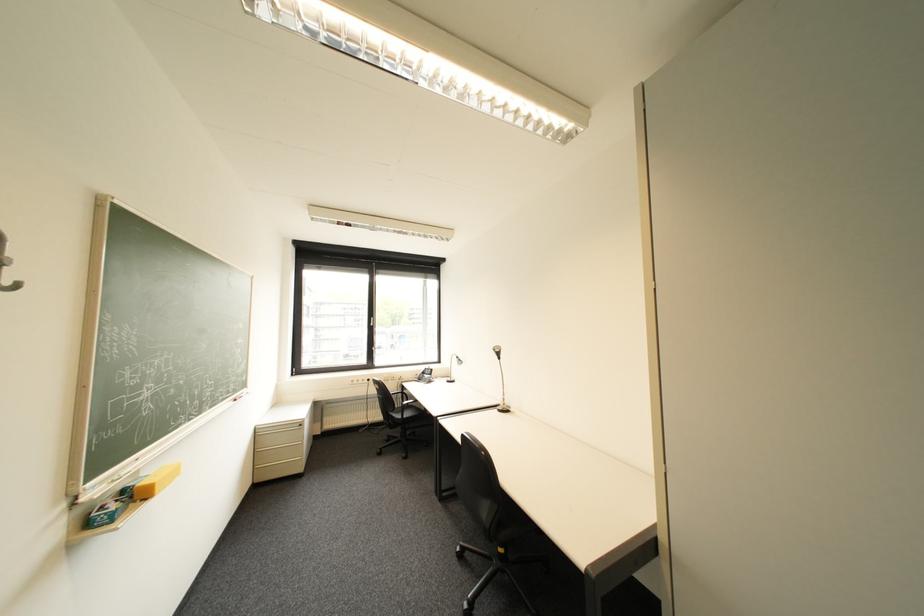
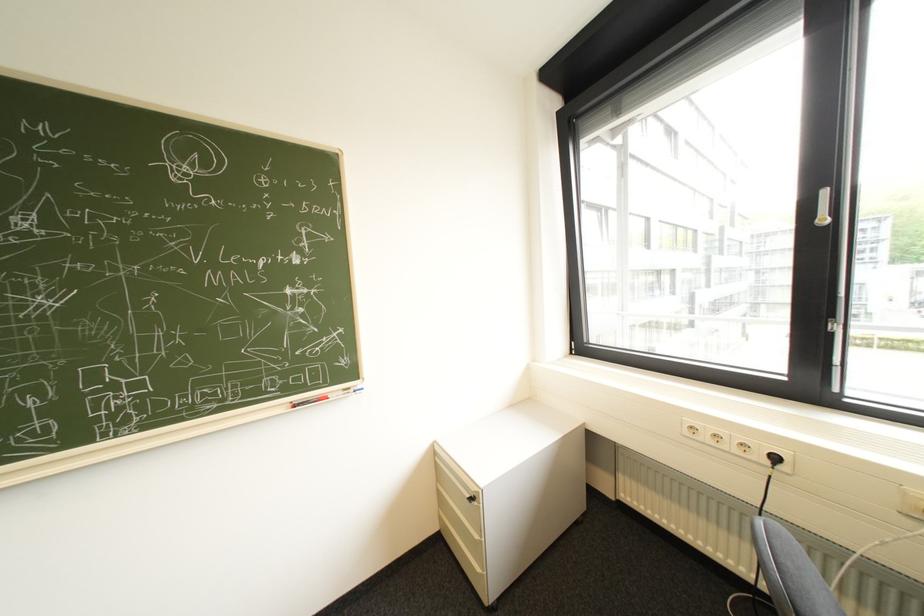
Find the pixel in the second image that matches pixel 383 318 in the first image.

(834, 193)